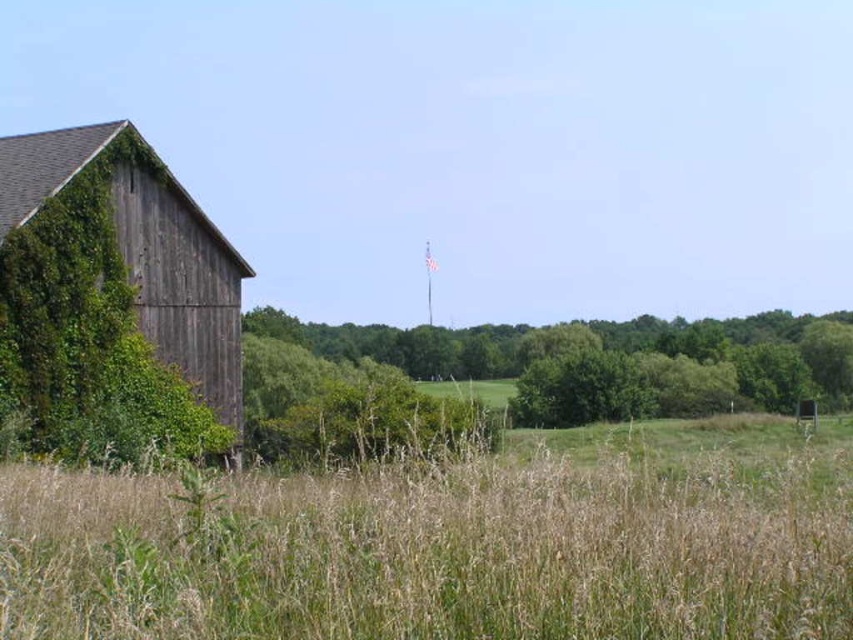
Question: Which object is closer to the camera taking this photo?

Choices:
 (A) dry grass at center
 (B) green ivy-covered barn at left

Answer: (A)

Question: Which of the following is the farthest from the observer?

Choices:
 (A) (86, 184)
 (B) (61, 572)

Answer: (A)

Question: Does dry grass at center appear on the left side of green ivy-covered barn at left?

Choices:
 (A) yes
 (B) no

Answer: (B)

Question: Which point appears farthest from the camera in this image?

Choices:
 (A) (503, 634)
 (B) (141, 152)

Answer: (B)

Question: Considering the relative positions of dry grass at center and green ivy-covered barn at left in the image provided, where is dry grass at center located with respect to green ivy-covered barn at left?

Choices:
 (A) left
 (B) right

Answer: (B)

Question: Is dry grass at center positioned before green ivy-covered barn at left?

Choices:
 (A) no
 (B) yes

Answer: (B)